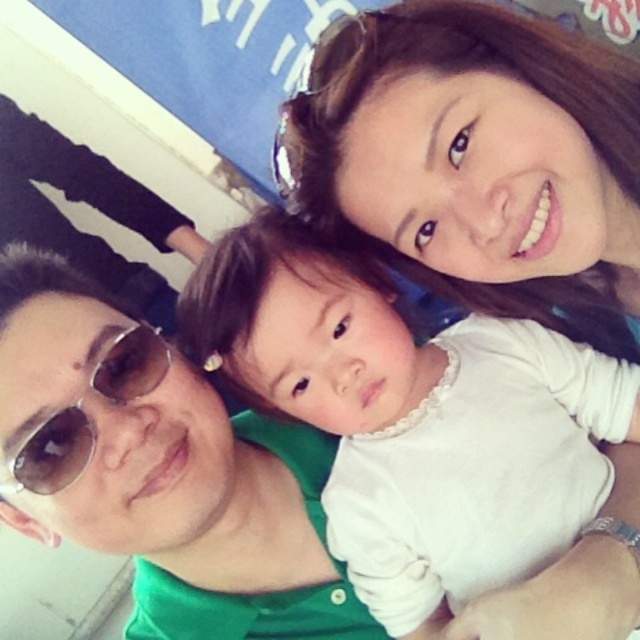
You are a photographer analyzing the composition of this family selfie. You notice the white soft fabric at center and sunglasses at left. Based on their positions, which object is closer to the right edge of the photo?

The white soft fabric at center is to the right of sunglasses at left, so the white soft fabric at center is closer to the right edge of the photo.

What is the location of the point with coordinates (x=413, y=419) in the image?

The point with coordinates (x=413, y=419) is located on the white soft fabric at center.